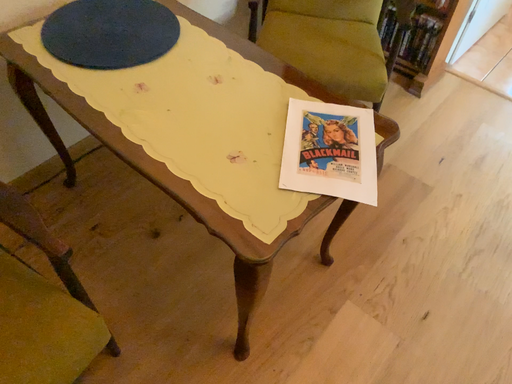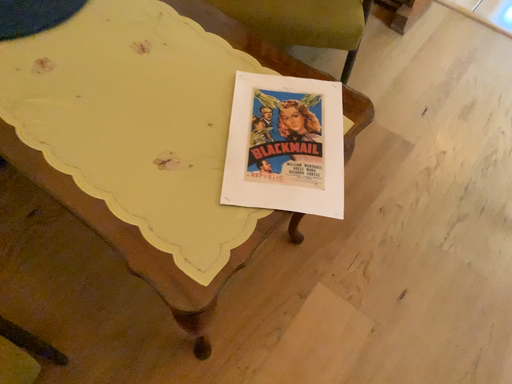
Question: Which way did the camera rotate in the video?

Choices:
 (A) rotated downward
 (B) rotated upward

Answer: (A)